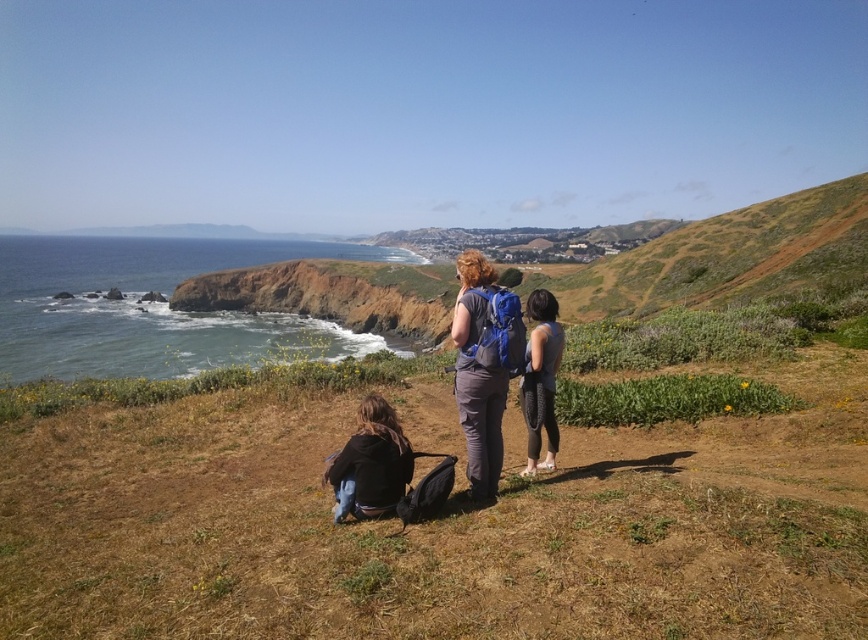
Consider the image. You are standing on the grassy hillside and want to walk to the blue water at left without getting your shoes wet. Which direction should you walk from the matte blue backpack at center?

You should walk to the left from the matte blue backpack at center to reach the blue water at left since the blue water at left is located to the left of the matte blue backpack at center.

You are planning to pack your matte blue backpack at center for a hike and need to ensure it fits your black mesh leggings at center. Based on the scene, will the backpack accommodate the leggings vertically?

The matte blue backpack at center is taller than black mesh leggings at center, so the backpack can accommodate the leggings vertically.

You are a photographer trying to capture the blue water at left and the matte blue backpack at center in the same frame. Based on their positions, which object should you focus on first to ensure both are in focus?

The blue water at left is closer to you than the matte blue backpack at center, so you should focus on the blue water at left first to ensure both are in focus.